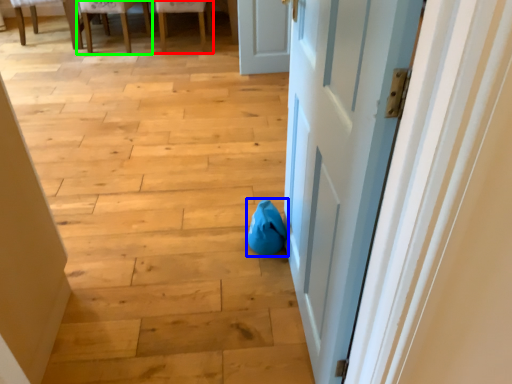
Question: Considering the real-world distances, which object is closest to chair (highlighted by a red box)? bean bag chair (highlighted by a blue box) or chair (highlighted by a green box).

Choices:
 (A) bean bag chair
 (B) chair

Answer: (B)